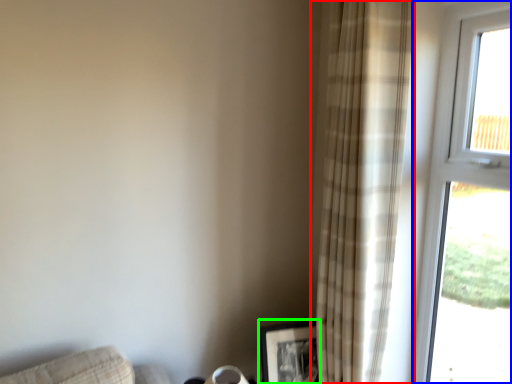
Question: Which is nearer to the curtain (highlighted by a red box)? window (highlighted by a blue box) or picture frame (highlighted by a green box).

Choices:
 (A) window
 (B) picture frame

Answer: (A)